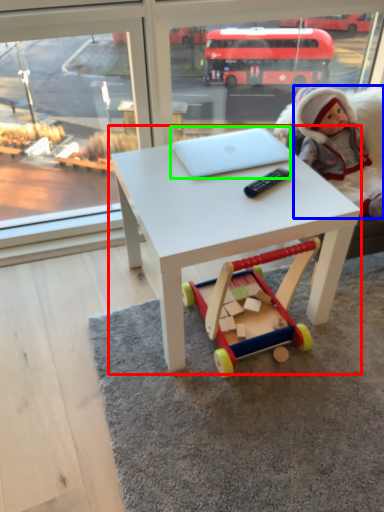
Question: Based on their relative distances, which object is nearer to table (highlighted by a red box)? Choose from person (highlighted by a blue box) and laptop (highlighted by a green box).

Choices:
 (A) person
 (B) laptop

Answer: (B)